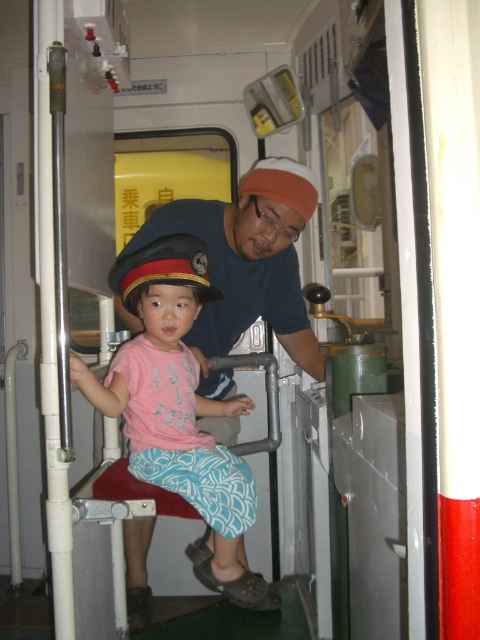
Question: Which of the following is the farthest from the observer?

Choices:
 (A) (254, 163)
 (B) (118, 403)
 (C) (195, 275)

Answer: (A)

Question: Does pink fabric shirt at center appear on the right side of black felt hat at center?

Choices:
 (A) yes
 (B) no

Answer: (A)

Question: Can you confirm if pink fabric shirt at center is thinner than orange knit cap at upper center?

Choices:
 (A) yes
 (B) no

Answer: (B)

Question: Which object is farther from the camera taking this photo?

Choices:
 (A) pink fabric shirt at center
 (B) black felt hat at center

Answer: (B)

Question: Considering the real-world distances, which object is farthest from the orange knit cap at upper center?

Choices:
 (A) black felt hat at center
 (B) pink fabric shirt at center

Answer: (B)

Question: Does pink fabric shirt at center appear on the right side of black felt hat at center?

Choices:
 (A) yes
 (B) no

Answer: (A)